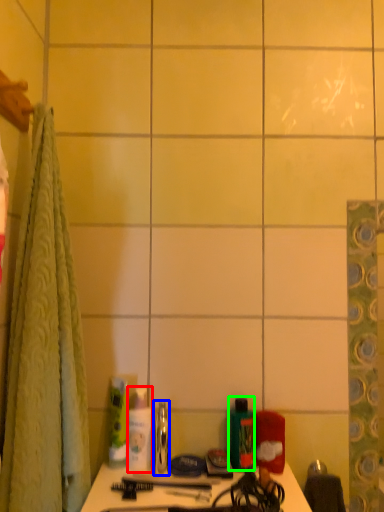
Question: Considering the real-world distances, which object is closest to toiletry (highlighted by a red box)? mouthwash (highlighted by a blue box) or mouthwash (highlighted by a green box).

Choices:
 (A) mouthwash
 (B) mouthwash

Answer: (A)